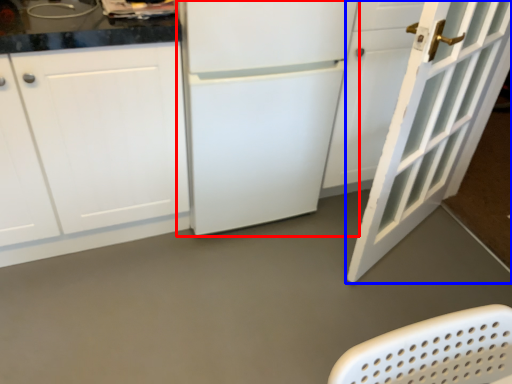
Question: Which of the following is the farthest to the observer, refrigerator (highlighted by a red box) or door (highlighted by a blue box)?

Choices:
 (A) refrigerator
 (B) door

Answer: (A)